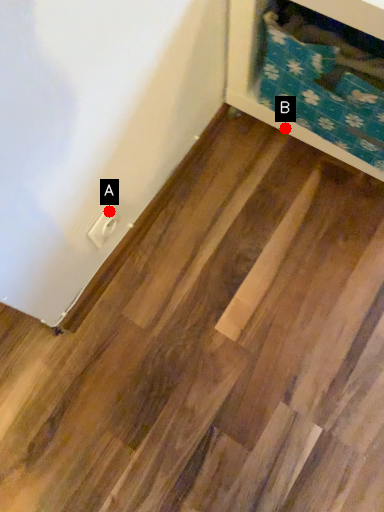
Question: Two points are circled on the image, labeled by A and B beside each circle. Which point is farther to the camera?

Choices:
 (A) A is further
 (B) B is further

Answer: (B)